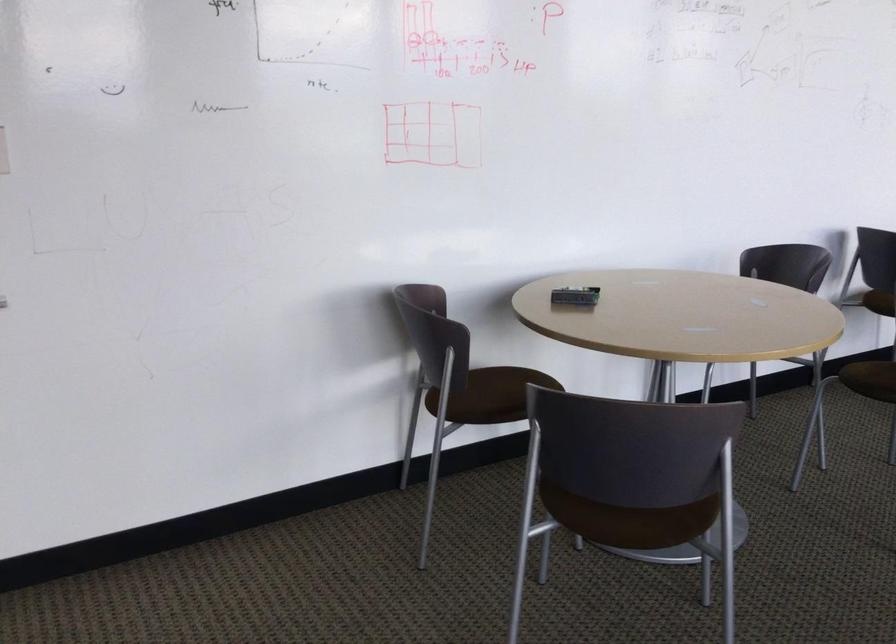
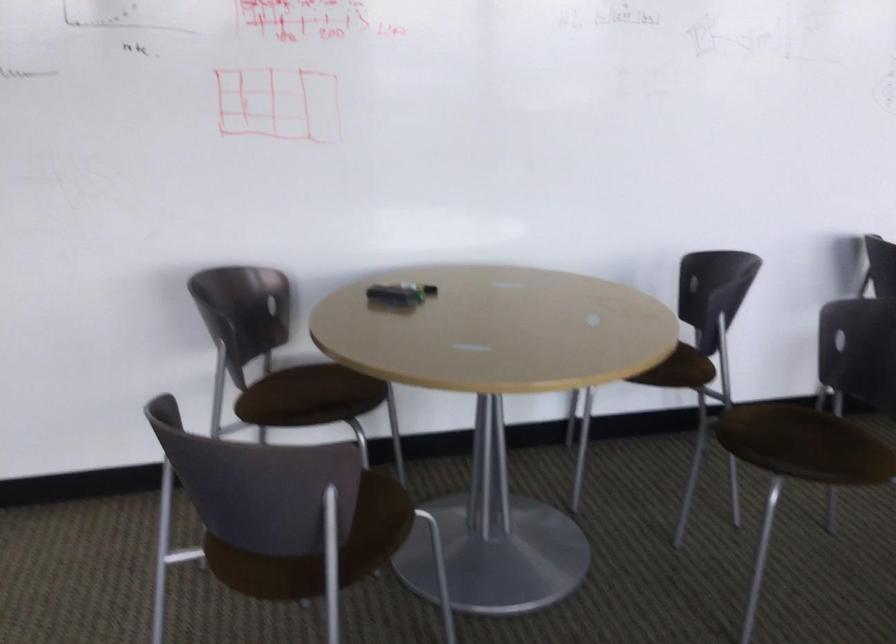
Question: What movement of the cameraman would produce the second image?

Choices:
 (A) Left
 (B) Right
 (C) Forward
 (D) Backward

Answer: (B)